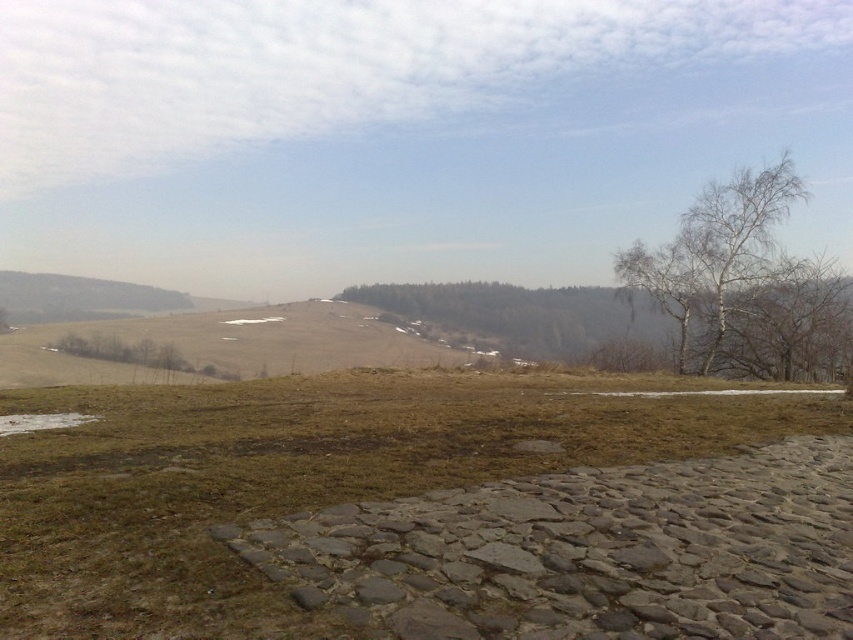
You are standing at the starting point of the cobblestone path in the foreground. You want to walk straight ahead towards the center of the image. Will you encounter the brown grass at center before reaching the midpoint of your journey?

Yes, because the brown grass at center is located at point 0.692 on the x and y coordinates, which means it is closer to the starting point than the midpoint of the journey would be.